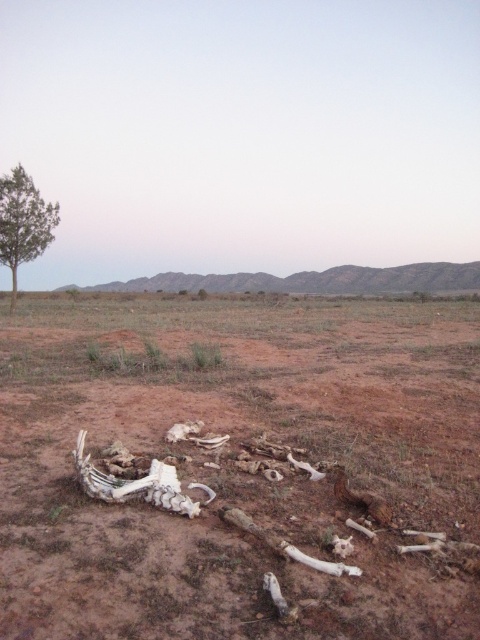
Question: Which object appears farthest from the camera in this image?

Choices:
 (A) green leafy tree at left
 (B) brown dirt field at center

Answer: (A)

Question: Does brown dirt field at center have a smaller size compared to green leafy tree at left?

Choices:
 (A) yes
 (B) no

Answer: (B)

Question: Where is brown dirt field at center located in relation to green leafy tree at left in the image?

Choices:
 (A) below
 (B) above

Answer: (A)

Question: Which point is farther to the camera?

Choices:
 (A) (1, 243)
 (B) (408, 611)

Answer: (A)

Question: Is brown dirt field at center bigger than green leafy tree at left?

Choices:
 (A) yes
 (B) no

Answer: (A)